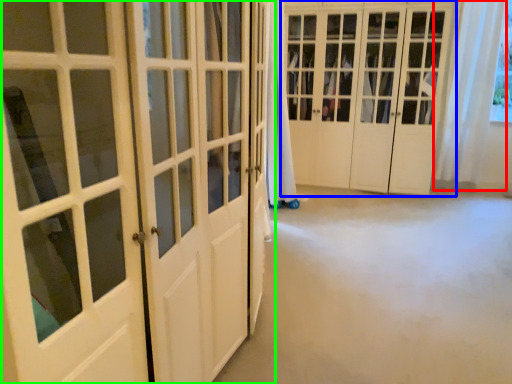
Question: Based on their relative distances, which object is nearer to curtain (highlighted by a red box)? Choose from door (highlighted by a blue box) and door (highlighted by a green box).

Choices:
 (A) door
 (B) door

Answer: (A)